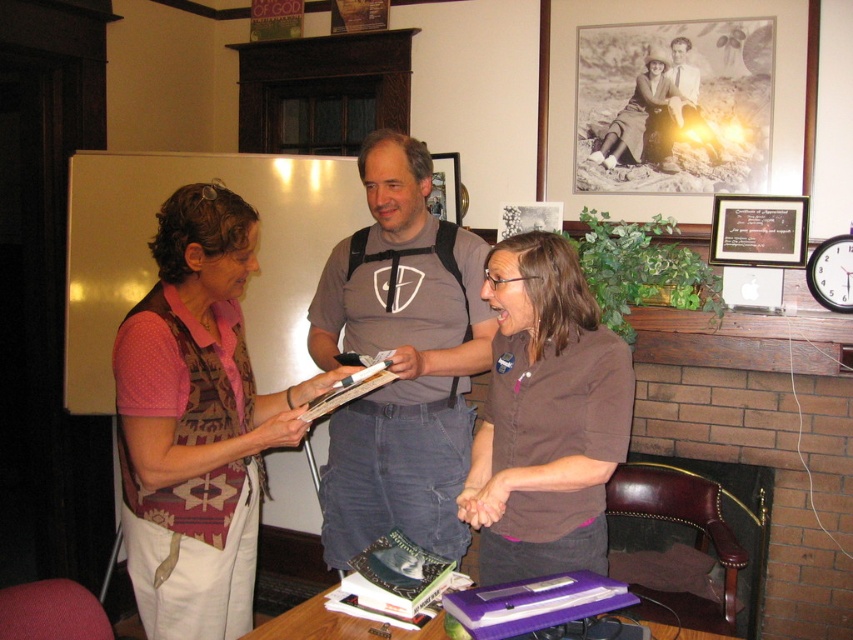
You are standing in the room and want to place a new painting that is 9 feet wide on the wall where the matte black picture frame at upper right is currently hanging. Will the painting fit if the wall space there is exactly the same width as the frame?

The matte black picture frame at upper right is 8.67 feet from viewer. Since the painting is 9 feet wide and the wall space is the same as the frame, the painting will not fit as it is slightly wider than the available space.

Based on the scene description, where is the black matte picture frame at upper center located in terms of its 2D coordinates?

The black matte picture frame at upper center is located at the 2D coordinates of point (659, 19).

You are a photographer positioned behind the brown matte shirt at center and the purple plastic book at lower center. Which object is closer to you?

The brown matte shirt at center is closer to you since it is further to the viewer than the purple plastic book at lower center.